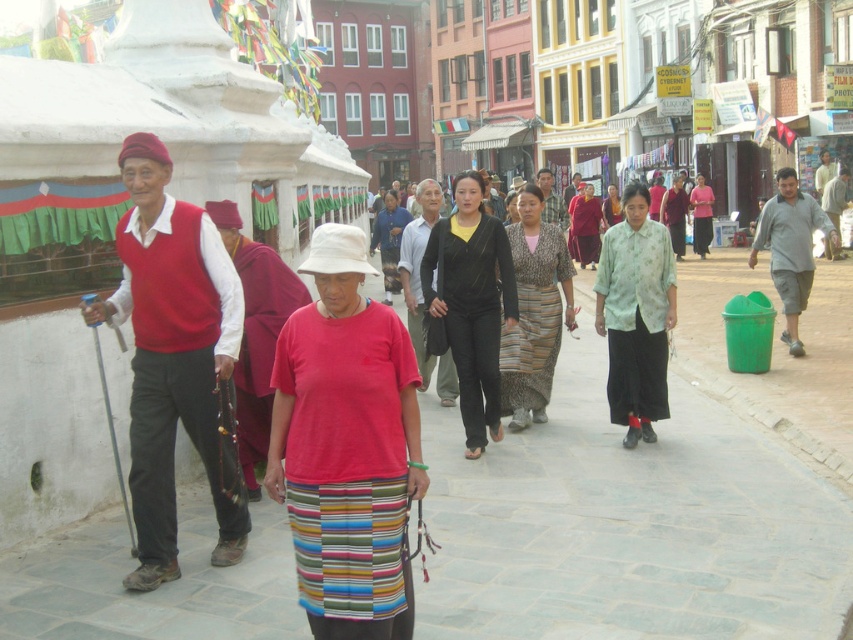
Question: Among these objects, which one is nearest to the camera?

Choices:
 (A) maroon velvet robe at center
 (B) black matte pants at center
 (C) gray stone pavement at center

Answer: (C)

Question: Which of the following is the closest to the observer?

Choices:
 (A) (820, 208)
 (B) (821, 202)

Answer: (A)

Question: Is red cotton shirt at center wider than floral silk blouse at center?

Choices:
 (A) yes
 (B) no

Answer: (A)

Question: Which object appears farthest from the camera in this image?

Choices:
 (A) patterned fabric dress at center
 (B) light brown textured shirt at right
 (C) dark brown leather jacket at center

Answer: (B)

Question: From the image, what is the correct spatial relationship of dark red velvet robe at center in relation to light brown textured shirt at right?

Choices:
 (A) right
 (B) left

Answer: (B)

Question: Is matte red vest at left closer to the viewer compared to light brown leather shoes at lower right?

Choices:
 (A) no
 (B) yes

Answer: (B)